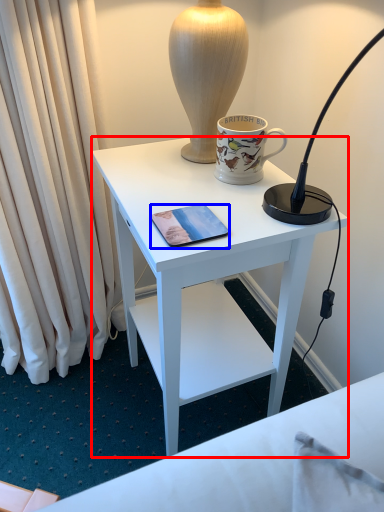
Question: Among these objects, which one is nearest to the camera, desk (highlighted by a red box) or mobile phone (highlighted by a blue box)?

Choices:
 (A) desk
 (B) mobile phone

Answer: (A)